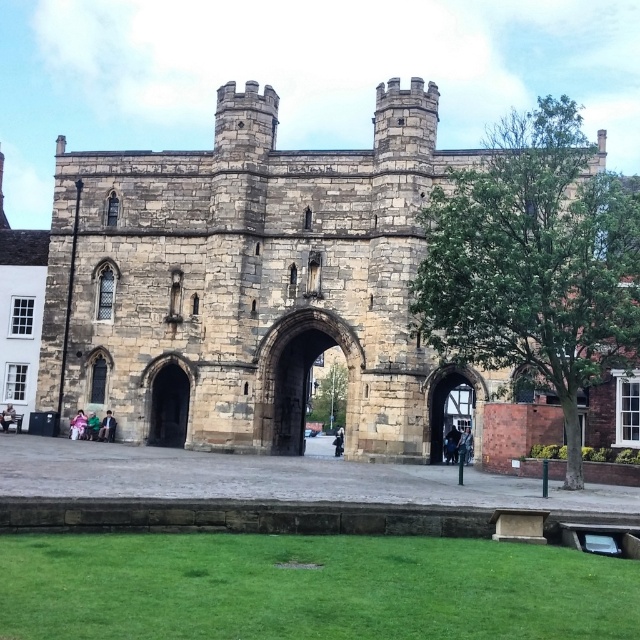
Is the position of wooden gate at center less distant than that of light pink fabric at lower left?

Yes, it is.

Is point (436, 435) positioned behind point (97, 419)?

No, (436, 435) is in front of (97, 419).

You are a GUI agent. You are given a task and a screenshot of the screen. Output one action in this format:
    pyautogui.click(x=<x>, y=<y>)
    Task: Click on the wooden gate at center
    The width and height of the screenshot is (640, 640).
    Given the screenshot: What is the action you would take?
    pyautogui.click(x=445, y=406)

Does wooden gate at center have a lesser height compared to dark green fabric jacket at center?

In fact, wooden gate at center may be taller than dark green fabric jacket at center.

Is wooden gate at center to the right of dark green fabric jacket at center from the viewer's perspective?

Incorrect, wooden gate at center is not on the right side of dark green fabric jacket at center.

Which is behind, point (452, 387) or point (465, 445)?

Point (452, 387)

Find the location of a particular element. wooden gate at center is located at coordinates (445, 406).

Who is more distant from viewer, (278, 364) or (467, 440)?

Point (278, 364)

Does stone castle at center have a greater width compared to dark green fabric jacket at center?

Correct, the width of stone castle at center exceeds that of dark green fabric jacket at center.

Find the location of a particular element. The image size is (640, 640). stone castle at center is located at coordinates (248, 276).